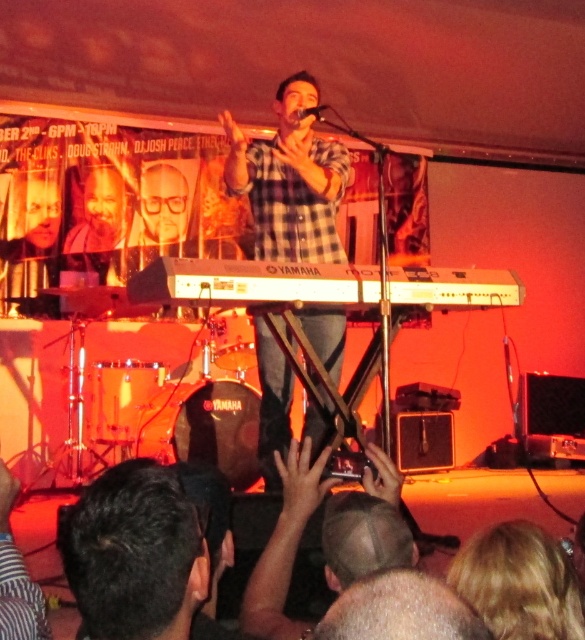
Between checkered fabric shirt at center and white plastic keyboard at center, which one has more height?

Standing taller between the two is checkered fabric shirt at center.

Who is more distant from viewer, (270,234) or (452,280)?

The point (270,234) is more distant.

In the scene shown: Who is more forward, [232,120] or [292,285]?

Point [292,285] is more forward.

I want to click on checkered fabric shirt at center, so click(x=290, y=180).

Based on the photo, which is above, smooth skin head at center or metallic silver microphone at center?

metallic silver microphone at center

Between smooth skin head at center and metallic silver microphone at center, which one is positioned lower?

smooth skin head at center is lower down.

Locate an element on the screen. The image size is (585, 640). smooth skin head at center is located at coordinates (366, 525).

Identify the location of smooth skin head at center. (366, 525).

Is checkered fabric shirt at center thinner than metallic silver microphone at center?

Answer: No.

Who is more distant from viewer, (324, 212) or (301, 109)?

The point (324, 212) is behind.

Is point (259, 180) in front of point (315, 108)?

No, it is not.

At what (x,y) coordinates should I click in order to perform the action: click on checkered fabric shirt at center. Please return your answer as a coordinate pair (x, y). The width and height of the screenshot is (585, 640). Looking at the image, I should click on (290, 180).